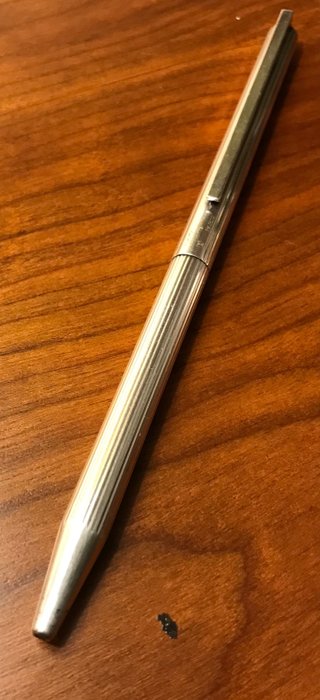
Identify the location of wood table. This screenshot has height=700, width=320. (227, 570).